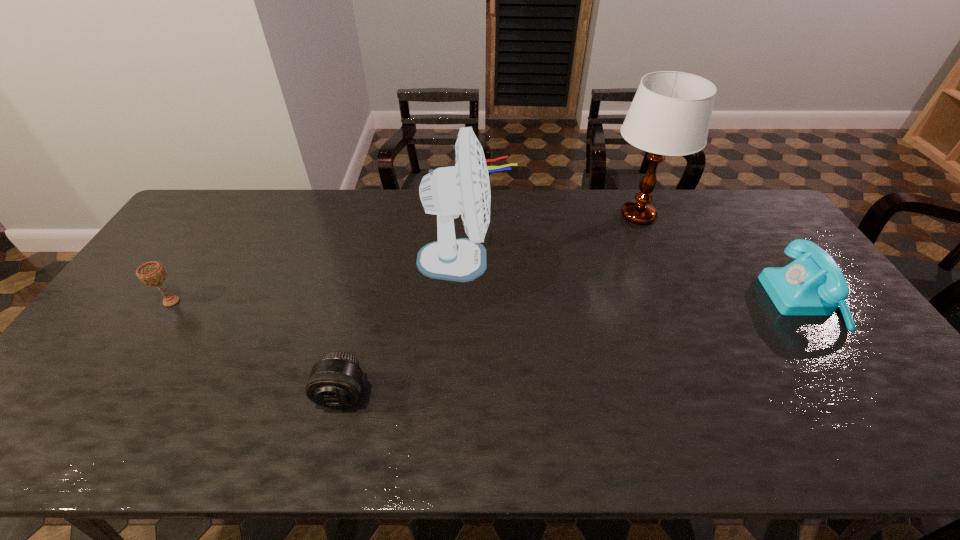
Locate an element on the screen. vacant region between the fan and the chalice is located at coordinates (319, 281).

Where is `the second closest object to the leftmost object`? The width and height of the screenshot is (960, 540). the second closest object to the leftmost object is located at coordinates (447, 192).

Locate which object ranks in proximity to the leftmost object. Please provide its 2D coordinates. Your answer should be formatted as a tuple, i.e. [(x, y)], where the tuple contains the x and y coordinates of a point satisfying the conditions above.

[(335, 381)]

Where is `vacant space that satisfies the following two spatial constraints: 1. on the grille of the third object from right to left; 2. on the front-facing side of the telephoto lens`? The image size is (960, 540). vacant space that satisfies the following two spatial constraints: 1. on the grille of the third object from right to left; 2. on the front-facing side of the telephoto lens is located at coordinates (460, 394).

Locate an element on the screen. free spot that satisfies the following two spatial constraints: 1. on the dial of the telephone; 2. on the front-facing side of the nearest object is located at coordinates (870, 394).